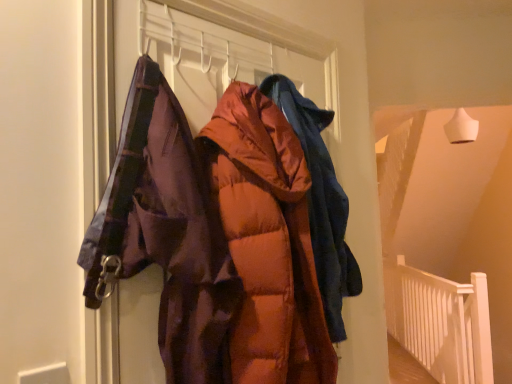
Question: Considering the positions of point (273, 344) and point (316, 201), is point (273, 344) closer or farther from the camera than point (316, 201)?

Choices:
 (A) closer
 (B) farther

Answer: (A)

Question: From their relative heights in the image, would you say orange puffy jacket at center, the second jacket in the back-to-front sequence, is taller or shorter than matte orange puffer jacket at center, the first jacket in the back-to-front sequence?

Choices:
 (A) short
 (B) tall

Answer: (B)

Question: Which object is the closest to the white wooden balustrade at lower right?

Choices:
 (A) matte orange puffer jacket at center, the first jacket in the back-to-front sequence
 (B) orange puffy jacket at center, the second jacket in the back-to-front sequence

Answer: (A)

Question: Estimate the real-world distances between objects in this image. Which object is closer to the matte orange puffer jacket at center, the first jacket in the back-to-front sequence?

Choices:
 (A) orange puffy jacket at center, the second jacket in the back-to-front sequence
 (B) white wooden balustrade at lower right

Answer: (A)